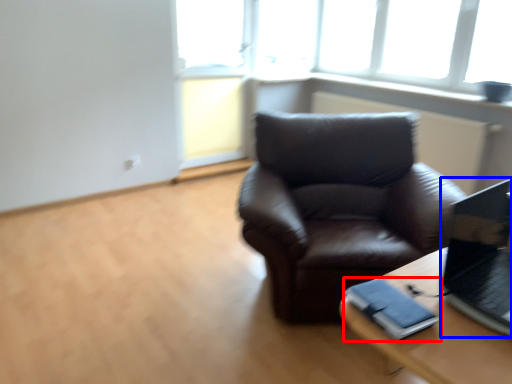
Question: Which point is closer to the camera, binder (highlighted by a red box) or laptop (highlighted by a blue box)?

Choices:
 (A) binder
 (B) laptop

Answer: (B)